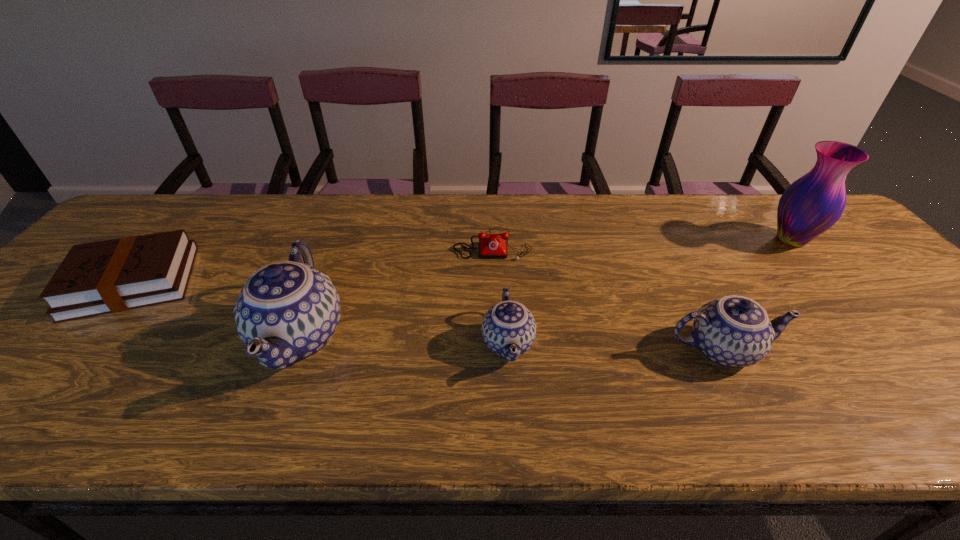
At what (x,y) coordinates should I click in order to perform the action: click on the fifth object from right to left. Please return your answer as a coordinate pair (x, y). The image size is (960, 540). Looking at the image, I should click on (287, 311).

This screenshot has width=960, height=540. Identify the location of the second tallest object. click(287, 311).

Locate an element on the screen. the shortest chinaware is located at coordinates (509, 329).

The image size is (960, 540). I want to click on the third shortest object, so click(x=509, y=329).

Where is `the fourth shortest object`? This screenshot has width=960, height=540. the fourth shortest object is located at coordinates (735, 331).

You are a GUI agent. You are given a task and a screenshot of the screen. Output one action in this format:
    pyautogui.click(x=<x>, y=<y>)
    Task: Click on the second tallest chinaware
    Image resolution: width=960 pixels, height=540 pixels.
    Given the screenshot: What is the action you would take?
    pyautogui.click(x=735, y=331)

Locate an element on the screen. The height and width of the screenshot is (540, 960). the second shortest object is located at coordinates (110, 276).

Identify the location of hardback book. (110, 276).

Find the location of a particular element. the tallest object is located at coordinates (812, 204).

Locate an element on the screen. The width and height of the screenshot is (960, 540). the rightmost object is located at coordinates (812, 204).